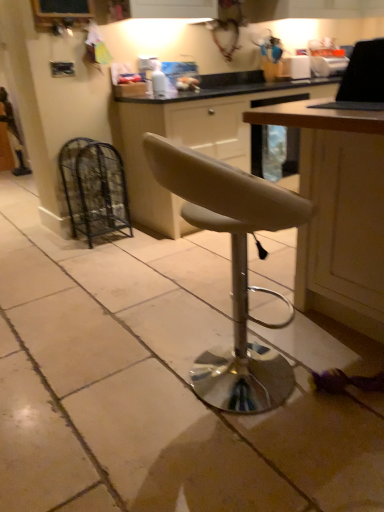
At what (x,y) coordinates should I click in order to perform the action: click on vacant space that's between wooden table at right and black wire mesh cage at left. Please return your answer as a coordinate pair (x, y). This screenshot has width=384, height=512. Looking at the image, I should click on (195, 266).